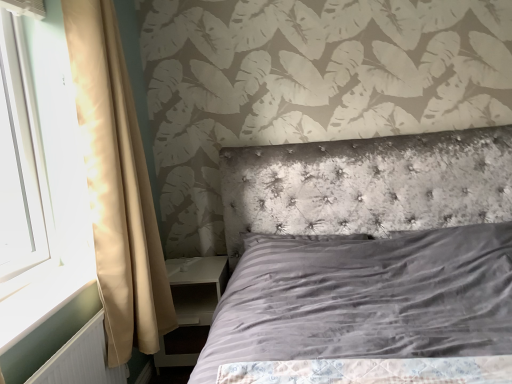
Question: Looking at their shapes, would you say velvet tufted headboard at center is wider or thinner than white glossy wood at left?

Choices:
 (A) wide
 (B) thin

Answer: (A)

Question: Would you say velvet tufted headboard at center is to the left or to the right of white glossy wood at left in the picture?

Choices:
 (A) right
 (B) left

Answer: (A)

Question: Which object is the farthest from the white glossy wood at left?

Choices:
 (A) velvet tufted headboard at center
 (B) white glossy nightstand at lower left
 (C) white plastic radiator at lower left
 (D) beige satin curtain at left
 (E) white plastic window screen at left

Answer: (A)

Question: Estimate the real-world distances between objects in this image. Which object is farther from the white plastic window screen at left?

Choices:
 (A) white glossy wood at left
 (B) white glossy nightstand at lower left
 (C) velvet tufted headboard at center
 (D) beige satin curtain at left
 (E) white plastic radiator at lower left

Answer: (C)